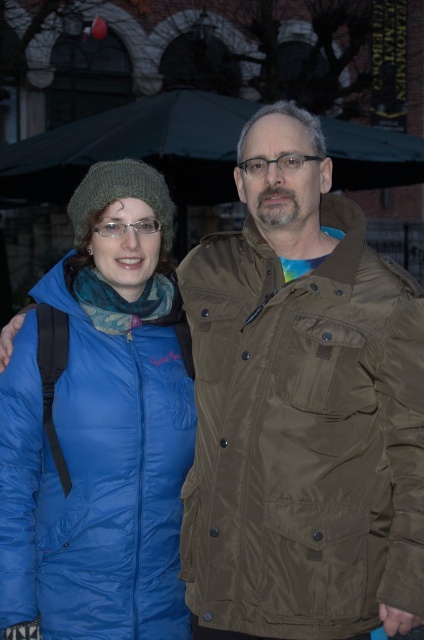
Who is positioned more to the right, olive green fabric jacket at right or matte blue puffer jacket at center?

olive green fabric jacket at right is more to the right.

Between olive green fabric jacket at right and matte blue puffer jacket at center, which one has more height?

matte blue puffer jacket at center is taller.

This screenshot has width=424, height=640. In order to click on olive green fabric jacket at right in this screenshot , I will do `click(303, 435)`.

Identify the location of olive green fabric jacket at right. This screenshot has height=640, width=424. (303, 435).